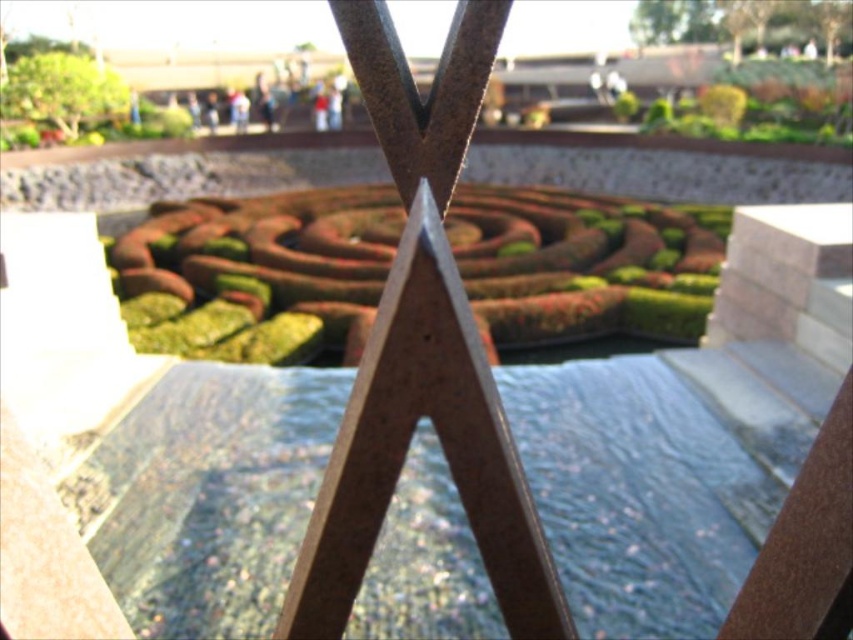
Between clear glass water at center and green textured hedge at upper left, which one has more height?

With more height is green textured hedge at upper left.

Is point (93, 545) closer to viewer compared to point (42, 116)?

Yes, it is.

Image resolution: width=853 pixels, height=640 pixels. What are the coordinates of `clear glass water at center` in the screenshot? It's located at (653, 483).

Looking at this image, measure the distance between clear glass water at center and camera.

clear glass water at center and camera are 2.82 meters apart.

Between clear glass water at center and green mossy hedge at center, which one is positioned lower?

clear glass water at center is below.

Is point (250, 573) closer to camera compared to point (709, 230)?

Yes, it is.

Find the location of a particular element. clear glass water at center is located at coordinates (653, 483).

Between green mossy hedge at center and green textured hedge at upper left, which one is positioned higher?

green textured hedge at upper left

Who is more forward, (250,248) or (86,106)?

Point (250,248) is in front.

Measure the distance between green mossy hedge at center and camera.

green mossy hedge at center and camera are 5.90 meters apart.

This screenshot has width=853, height=640. I want to click on green mossy hedge at center, so click(258, 268).